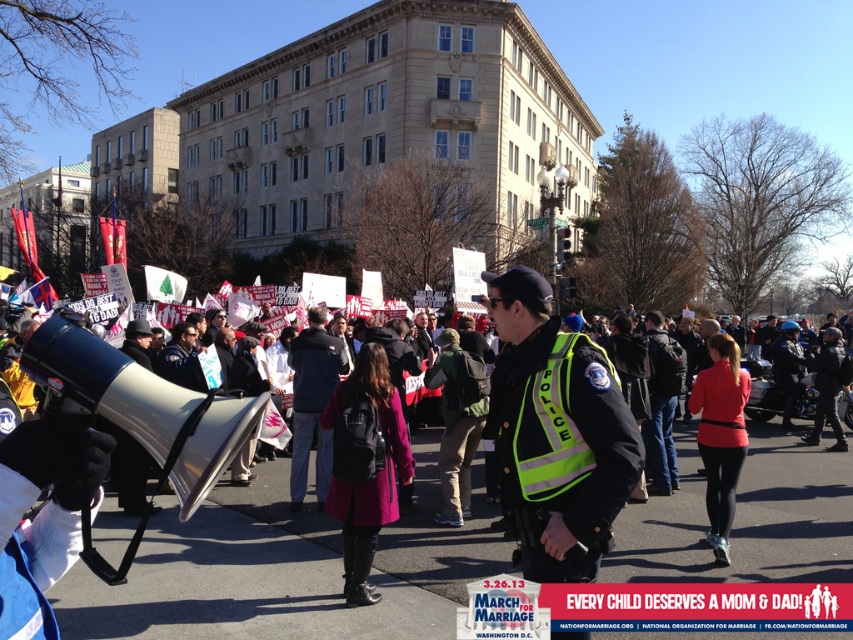
Question: Among these points, which one is nearest to the camera?

Choices:
 (A) (387, 465)
 (B) (709, 406)

Answer: (A)

Question: Which point is closer to the camera?

Choices:
 (A) (724, 387)
 (B) (598, 474)

Answer: (B)

Question: Is pink fabric coat at center above red matte jacket at center?

Choices:
 (A) yes
 (B) no

Answer: (B)

Question: Is pink fabric coat at center smaller than red matte jacket at center?

Choices:
 (A) yes
 (B) no

Answer: (A)

Question: Can you confirm if neon yellow reflective vest at center is thinner than pink fabric coat at center?

Choices:
 (A) yes
 (B) no

Answer: (A)

Question: Which is farther from the pink fabric coat at center?

Choices:
 (A) red matte jacket at center
 (B) neon yellow reflective vest at center

Answer: (A)